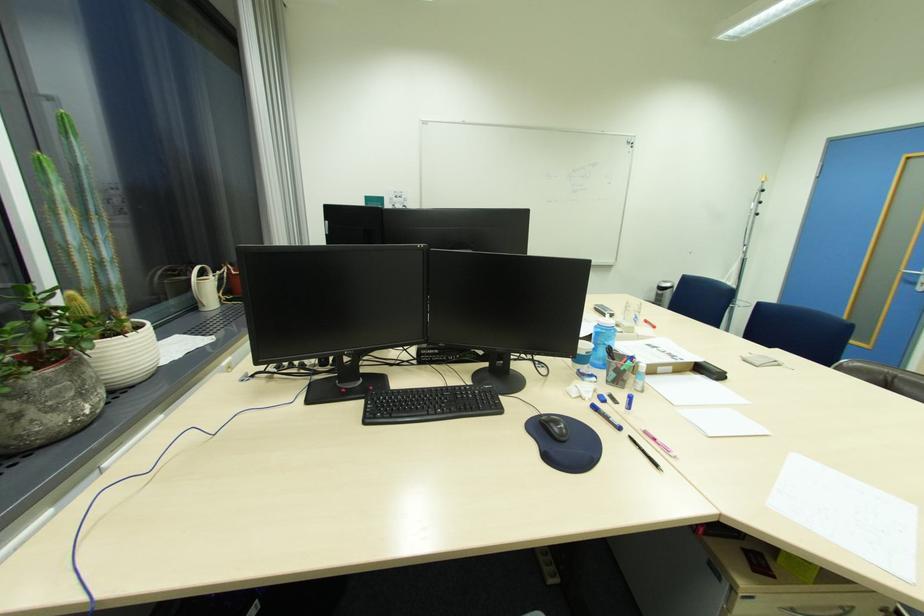
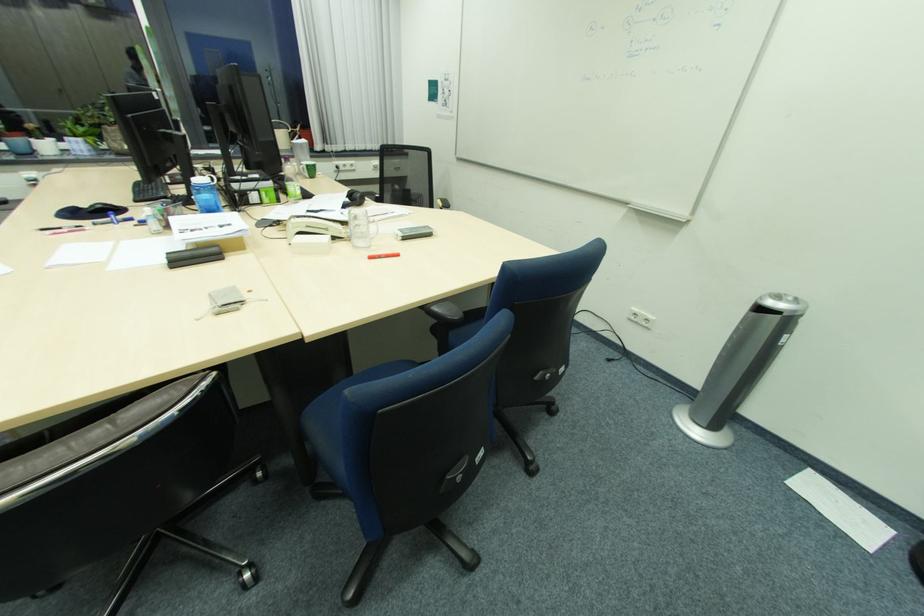
The point at [660,328] is marked in the first image. Where is the corresponding point in the second image?

(377, 257)